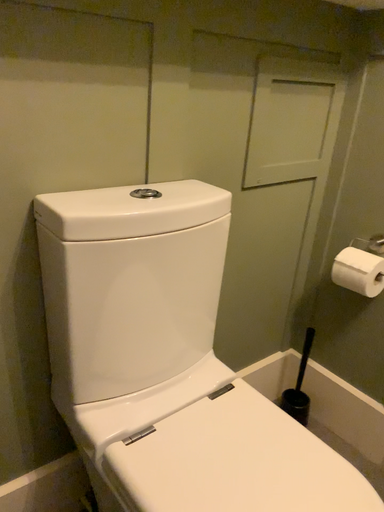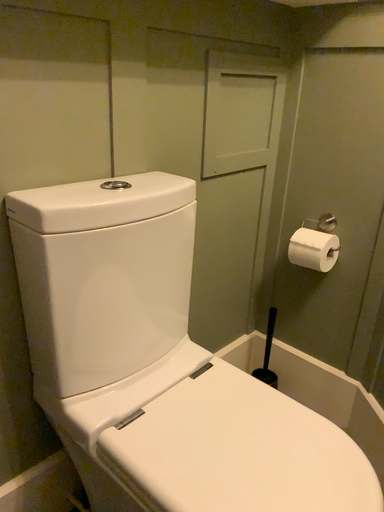
Question: Which way did the camera rotate in the video?

Choices:
 (A) rotated left
 (B) rotated right

Answer: (B)